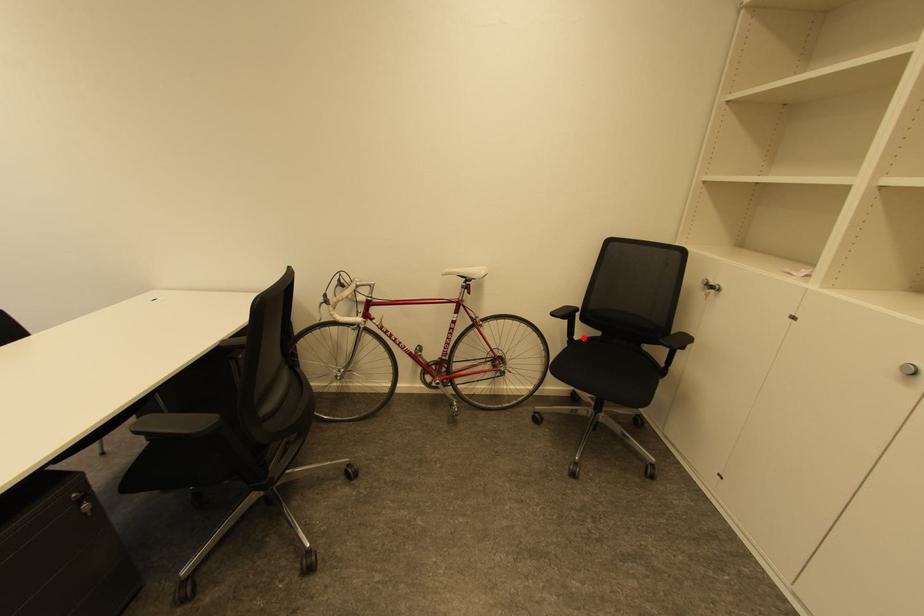
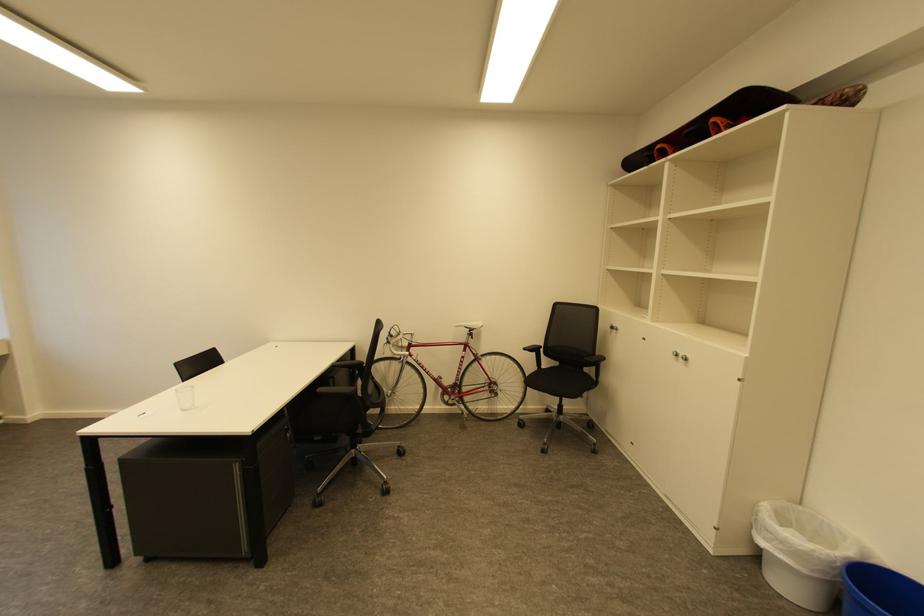
Question: I am providing you with two images of the same scene from different viewpoints. Given a red point in image1, look at the same physical point in image2. Is it:

Choices:
 (A) Closer to the viewpoint
 (B) Farther from the viewpoint

Answer: (B)